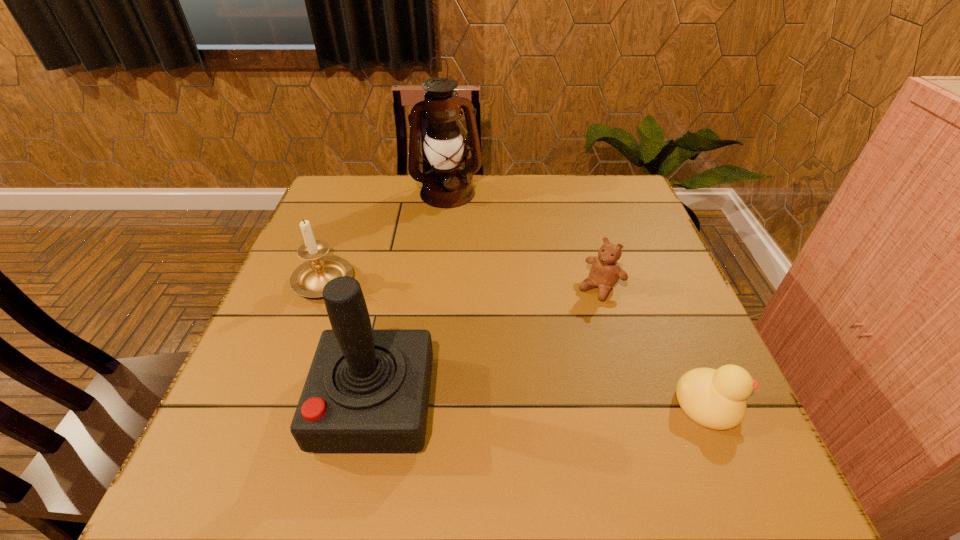
Where is `vacant region located on the side of the tallest object, there is a wick adjustment knob`? vacant region located on the side of the tallest object, there is a wick adjustment knob is located at coordinates (465, 237).

At what (x,y) coordinates should I click in order to perform the action: click on vacant region located 0.170m on the side of the tallest object, there is a wick adjustment knob. Please return your answer as a coordinate pair (x, y). Looking at the image, I should click on (467, 243).

Where is `free region located on the side of the tallest object, there is a wick adjustment knob`? This screenshot has height=540, width=960. free region located on the side of the tallest object, there is a wick adjustment knob is located at coordinates (462, 230).

In order to click on vacant space located on the face of the second object from right to left in this screenshot , I will do `click(544, 346)`.

At what (x,y) coordinates should I click in order to perform the action: click on vacant space located on the face of the second object from right to left. Please return your answer as a coordinate pair (x, y). The image size is (960, 540). Looking at the image, I should click on (561, 329).

Find the location of a particular element. This screenshot has height=540, width=960. vacant area situated on the face of the second object from right to left is located at coordinates (507, 387).

Where is `free space located 0.200m with a handle on the side of the candle holder`? Image resolution: width=960 pixels, height=540 pixels. free space located 0.200m with a handle on the side of the candle holder is located at coordinates (412, 330).

Where is `free space located with a handle on the side of the candle holder`? free space located with a handle on the side of the candle holder is located at coordinates (416, 332).

Where is `free space located 0.110m with a handle on the side of the candle holder`? The height and width of the screenshot is (540, 960). free space located 0.110m with a handle on the side of the candle holder is located at coordinates (382, 313).

This screenshot has height=540, width=960. In order to click on object present at the far edge in this screenshot , I will do pos(446,186).